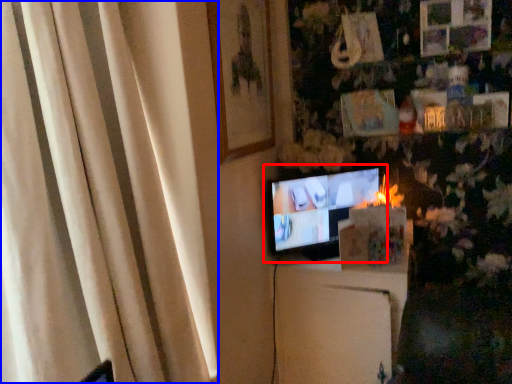
Question: Which object is further to the camera taking this photo, television (highlighted by a red box) or curtain (highlighted by a blue box)?

Choices:
 (A) television
 (B) curtain

Answer: (A)